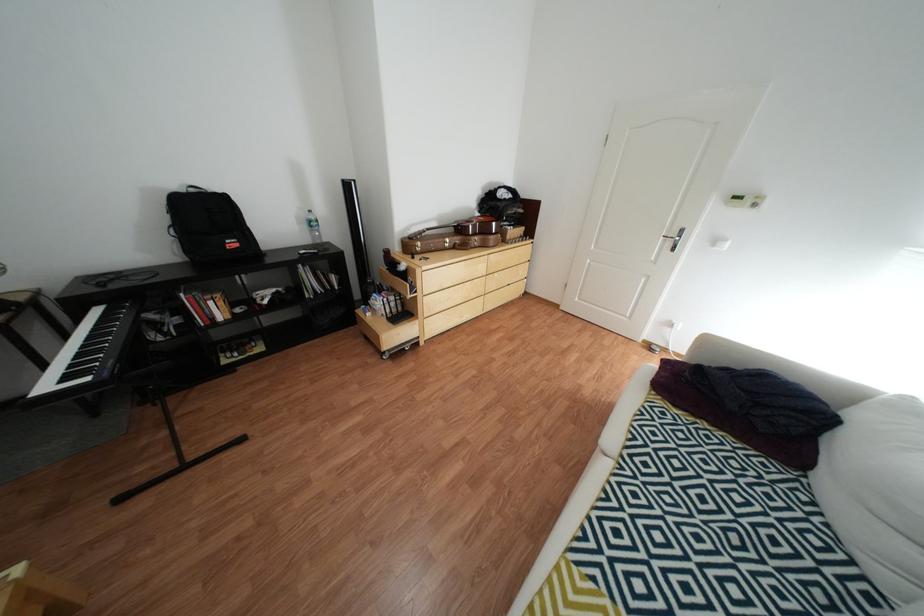
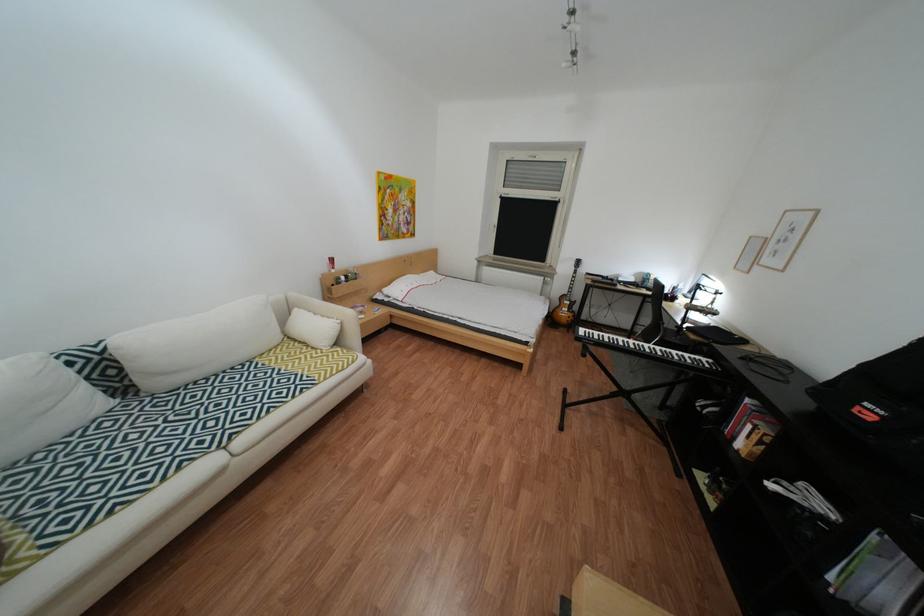
In the second image, find the point that corresponds to point 228,320 in the first image.

(749, 439)